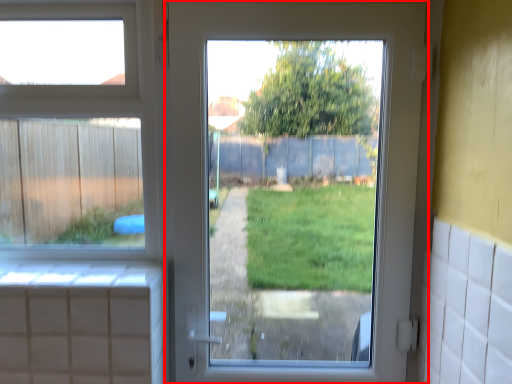
Question: Where is door (annotated by the red box) located in relation to window in the image?

Choices:
 (A) right
 (B) left

Answer: (A)